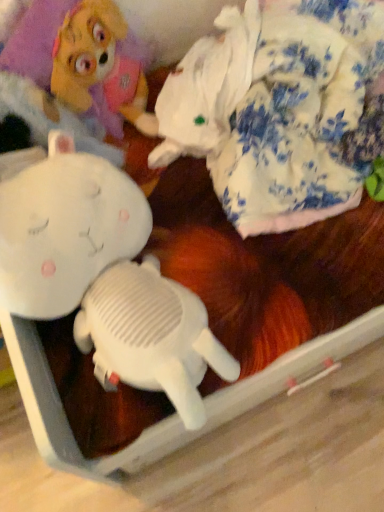
Question: From the image's perspective, would you say white plush rabbit at upper left, placed as the 3th toy when sorted from right to left, is shown under white plush toy at upper left?

Choices:
 (A) no
 (B) yes

Answer: (A)

Question: Is white plush rabbit at upper left, positioned as the 2th toy in left-to-right order, surrounding white plush toy at upper left?

Choices:
 (A) yes
 (B) no

Answer: (A)

Question: From a real-world perspective, is white plush rabbit at upper left, positioned as the 2th toy in left-to-right order, physically below white plush toy at upper left?

Choices:
 (A) yes
 (B) no

Answer: (B)

Question: Considering the relative sizes of white plush rabbit at upper left, placed as the 3th toy when sorted from right to left, and white plush toy at upper left in the image provided, is white plush rabbit at upper left, placed as the 3th toy when sorted from right to left, taller than white plush toy at upper left?

Choices:
 (A) yes
 (B) no

Answer: (A)

Question: Is white plush rabbit at upper left, positioned as the 2th toy in left-to-right order, wider than white plush toy at upper left?

Choices:
 (A) yes
 (B) no

Answer: (A)

Question: Is white matte toy at center, marked as the second toy in a right-to-left arrangement, to the left or to the right of fluffy white blanket at upper right, which appears as the first toy when viewed from the right, in the image?

Choices:
 (A) left
 (B) right

Answer: (A)

Question: Which is correct: white matte toy at center, marked as the second toy in a right-to-left arrangement, is inside fluffy white blanket at upper right, which is counted as the fourth toy, starting from the left, or outside of it?

Choices:
 (A) inside
 (B) outside

Answer: (B)

Question: In the image, is white matte toy at center, marked as the third toy in a left-to-right arrangement, positioned in front of or behind fluffy white blanket at upper right, which appears as the first toy when viewed from the right?

Choices:
 (A) front
 (B) behind

Answer: (A)

Question: From their relative heights in the image, would you say white matte toy at center, marked as the third toy in a left-to-right arrangement, is taller or shorter than fluffy white blanket at upper right, which is counted as the fourth toy, starting from the left?

Choices:
 (A) short
 (B) tall

Answer: (A)

Question: From the image's perspective, is white plush rabbit at upper left, positioned as the 2th toy in left-to-right order, above or below white plush toy at upper left?

Choices:
 (A) below
 (B) above

Answer: (B)

Question: In the image, is white plush rabbit at upper left, placed as the 3th toy when sorted from right to left, positioned in front of or behind white plush toy at upper left?

Choices:
 (A) front
 (B) behind

Answer: (A)

Question: From a real-world perspective, is white plush rabbit at upper left, placed as the 3th toy when sorted from right to left, above or below white plush toy at upper left?

Choices:
 (A) above
 (B) below

Answer: (A)

Question: Would you say white plush rabbit at upper left, positioned as the 2th toy in left-to-right order, is to the left or to the right of white plush toy at upper left in the picture?

Choices:
 (A) left
 (B) right

Answer: (B)

Question: From a real-world perspective, relative to white plush rabbit at upper left, positioned as the 2th toy in left-to-right order, is white plush toy at upper left vertically above or below?

Choices:
 (A) above
 (B) below

Answer: (B)

Question: Is white plush toy at upper left bigger or smaller than white plush rabbit at upper left, placed as the 3th toy when sorted from right to left?

Choices:
 (A) small
 (B) big

Answer: (A)